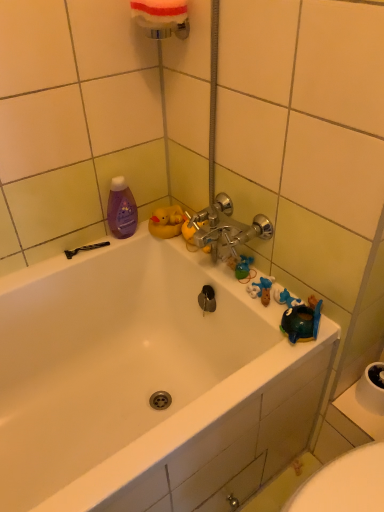
Question: Considering their positions, is purple glossy bottle at upper left located in front of or behind black plastic razor at lower left?

Choices:
 (A) front
 (B) behind

Answer: (A)

Question: Is purple glossy bottle at upper left inside or outside of black plastic razor at lower left?

Choices:
 (A) inside
 (B) outside

Answer: (B)

Question: Considering the real-world distances, which object is farthest from the purple glossy bottle at upper left?

Choices:
 (A) white glossy bathtub at upper center
 (B) black plastic razor at lower left
 (C) white foam sponge at upper center

Answer: (A)

Question: Based on their relative distances, which object is farther from the white glossy bathtub at upper center?

Choices:
 (A) purple glossy bottle at upper left
 (B) black plastic razor at lower left
 (C) white foam sponge at upper center

Answer: (C)